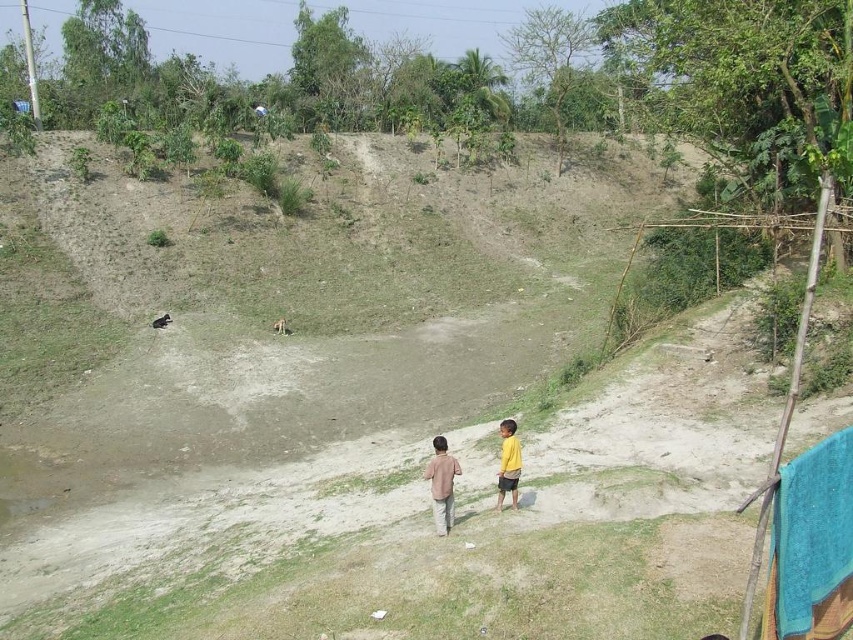
Question: Does brown cotton shirt at center have a larger size compared to yellow matte shirt at lower right?

Choices:
 (A) no
 (B) yes

Answer: (A)

Question: Which object is positioned farthest from the brown cotton shirt at center?

Choices:
 (A) yellow matte shirt at lower right
 (B) light brown cotton shirt at center

Answer: (A)

Question: Which object is closer to the camera taking this photo?

Choices:
 (A) light brown cotton shirt at center
 (B) brown cotton shirt at center
 (C) yellow matte shirt at lower right

Answer: (B)

Question: Can you confirm if brown cotton shirt at center is smaller than yellow matte shirt at lower right?

Choices:
 (A) no
 (B) yes

Answer: (B)

Question: Which point is farther to the camera?

Choices:
 (A) brown cotton shirt at center
 (B) light brown cotton shirt at center

Answer: (B)

Question: Is brown cotton shirt at center further to camera compared to yellow matte shirt at lower right?

Choices:
 (A) no
 (B) yes

Answer: (A)